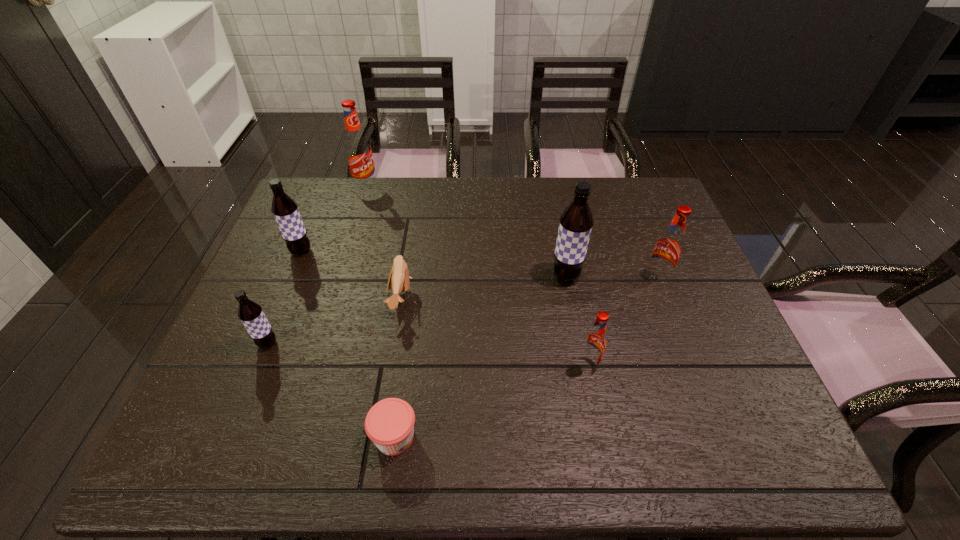
At what (x,y) coordinates should I click in order to perform the action: click on vacant space at the far right corner of the desktop. Please return your answer as a coordinate pair (x, y). Looking at the image, I should click on (639, 192).

Where is `free point between the rightmost root beer and the biggest brown root beer`? This screenshot has width=960, height=540. free point between the rightmost root beer and the biggest brown root beer is located at coordinates (612, 278).

Find the location of a particular element. The width and height of the screenshot is (960, 540). unoccupied area between the leftmost red root beer and the second farthest root beer is located at coordinates [x=334, y=219].

Where is `vacant space that is in between the seventh tallest object and the nearest object`? The height and width of the screenshot is (540, 960). vacant space that is in between the seventh tallest object and the nearest object is located at coordinates (397, 368).

The image size is (960, 540). I want to click on free space between the biggest brown root beer and the third root beer from left to right, so click(x=466, y=232).

At what (x,y) coordinates should I click in order to perform the action: click on free space between the fifth nearest root beer and the farthest object. Please return your answer as a coordinate pair (x, y). This screenshot has width=960, height=540. Looking at the image, I should click on (334, 219).

You are a GUI agent. You are given a task and a screenshot of the screen. Output one action in this format:
    pyautogui.click(x=<x>, y=<y>)
    Task: Click on the vacant point located between the second farthest red root beer and the second shortest object
    The image size is (960, 540).
    Given the screenshot: What is the action you would take?
    click(529, 288)

The width and height of the screenshot is (960, 540). What are the coordinates of `free spot between the rightmost brown root beer and the second nearest red root beer` in the screenshot? It's located at (612, 278).

Identify the location of empty location between the leftmost red root beer and the second farthest brown root beer. (466, 232).

This screenshot has width=960, height=540. I want to click on vacant region between the sixth object from right to left and the smallest red root beer, so click(x=477, y=276).